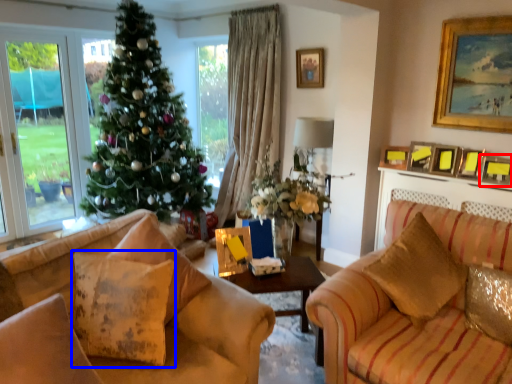
Question: Among these objects, which one is nearest to the camera, picture frame (highlighted by a red box) or pillow (highlighted by a blue box)?

Choices:
 (A) picture frame
 (B) pillow

Answer: (B)